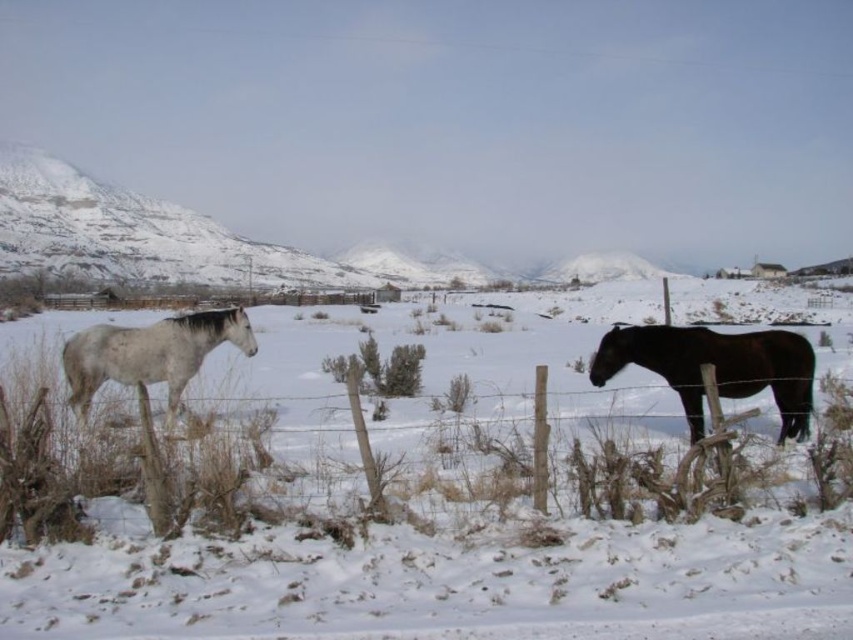
Question: Does wooden post fence at center lie behind white matte horse at left?

Choices:
 (A) no
 (B) yes

Answer: (A)

Question: Which object appears closest to the camera in this image?

Choices:
 (A) wooden post fence at center
 (B) shiny dark brown horse at right
 (C) white matte horse at left

Answer: (A)

Question: Which point is farther from the camera taking this photo?

Choices:
 (A) (492, 401)
 (B) (68, 358)

Answer: (A)

Question: Which point appears closest to the camera in this image?

Choices:
 (A) (616, 468)
 (B) (166, 378)
 (C) (22, 589)
 (D) (782, 408)

Answer: (C)

Question: Does wooden post fence at center appear over shiny dark brown horse at right?

Choices:
 (A) no
 (B) yes

Answer: (A)

Question: Is white fluffy snow at center closer to the viewer compared to shiny dark brown horse at right?

Choices:
 (A) no
 (B) yes

Answer: (B)